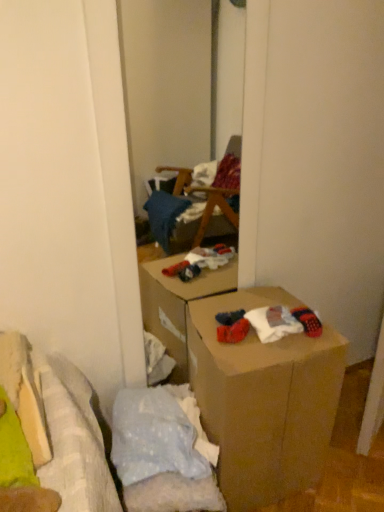
Question: Relative to brown cardboard box at center, is knitted wool socks at lower right in front or behind?

Choices:
 (A) behind
 (B) front

Answer: (A)

Question: Is knitted wool socks at lower right inside or outside of brown cardboard box at center?

Choices:
 (A) outside
 (B) inside

Answer: (B)

Question: Considering the positions of knitted wool socks at lower right and brown cardboard box at center in the image, is knitted wool socks at lower right taller or shorter than brown cardboard box at center?

Choices:
 (A) short
 (B) tall

Answer: (A)

Question: Is brown cardboard box at center taller or shorter than knitted wool socks at lower right?

Choices:
 (A) short
 (B) tall

Answer: (B)

Question: Considering the positions of brown cardboard box at center and knitted wool socks at lower right in the image, is brown cardboard box at center bigger or smaller than knitted wool socks at lower right?

Choices:
 (A) small
 (B) big

Answer: (B)

Question: Considering the relative positions of brown cardboard box at center and knitted wool socks at lower right in the image provided, is brown cardboard box at center to the left or to the right of knitted wool socks at lower right?

Choices:
 (A) right
 (B) left

Answer: (B)

Question: From the image's perspective, is brown cardboard box at center positioned above or below knitted wool socks at lower right?

Choices:
 (A) below
 (B) above

Answer: (A)